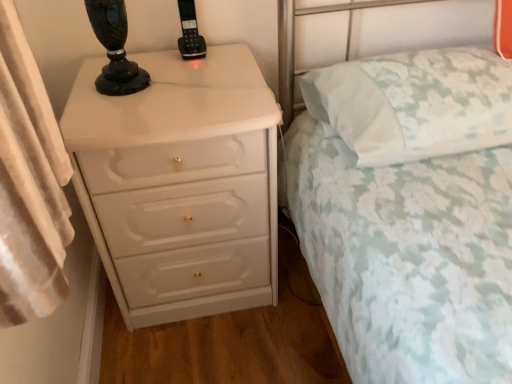
The height and width of the screenshot is (384, 512). I want to click on vacant area that is in front of black plastic phone at upper center, so click(190, 71).